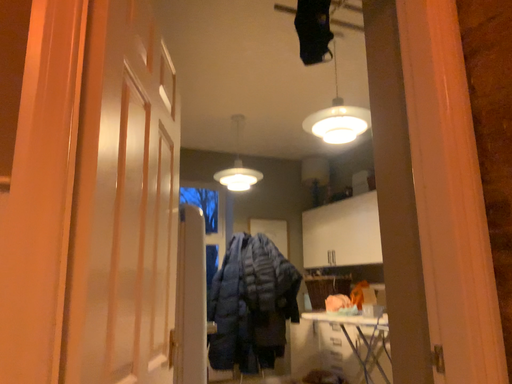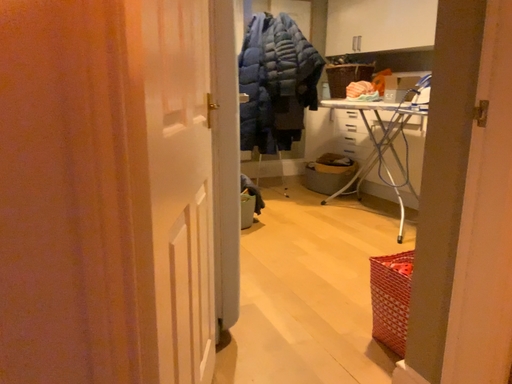
Question: Which way did the camera rotate in the video?

Choices:
 (A) rotated downward
 (B) rotated upward

Answer: (A)